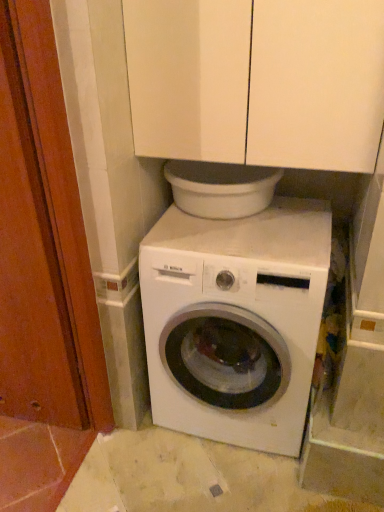
What do you see at coordinates (316, 84) in the screenshot?
I see `white matte cabinet at upper center` at bounding box center [316, 84].

In order to face concrete tile floor at center, should I rotate leftwards or rightwards?

To align with it, rotate right about 4.350°.

Measure the distance between wooden screen door at left and camera.

wooden screen door at left and camera are 3.35 feet apart from each other.

You are a GUI agent. You are given a task and a screenshot of the screen. Output one action in this format:
    pyautogui.click(x=<x>, y=<y>)
    Task: Click on the white matte cabinet at upper center
    The image size is (384, 512).
    Given the screenshot: What is the action you would take?
    pyautogui.click(x=316, y=84)

Which object is wider, wooden screen door at left or white glossy washing machine at center?

Wider between the two is white glossy washing machine at center.

Can you tell me how much wooden screen door at left and white glossy washing machine at center differ in facing direction?

The facing directions of wooden screen door at left and white glossy washing machine at center are 4.7 degrees apart.

In the image, is wooden screen door at left on the left side or the right side of white glossy washing machine at center?

From the image, it's evident that wooden screen door at left is to the left of white glossy washing machine at center.

From a real-world perspective, relative to white glossy washing machine at center, is wooden screen door at left vertically above or below?

wooden screen door at left is situated higher than white glossy washing machine at center in the real world.

Based on the photo, based on their positions, is concrete tile floor at center located to the left or right of white glossy washing machine at center?

concrete tile floor at center is to the left of white glossy washing machine at center.

Is concrete tile floor at center shorter than white glossy washing machine at center?

Indeed, concrete tile floor at center has a lesser height compared to white glossy washing machine at center.

Can you see concrete tile floor at center touching white glossy washing machine at center?

There is a gap between concrete tile floor at center and white glossy washing machine at center.

Measure the distance between concrete tile floor at center and white glossy washing machine at center.

concrete tile floor at center is 42.17 centimeters away from white glossy washing machine at center.

Where is `screen door lying on the left of white glossy washing machine at center`? The height and width of the screenshot is (512, 384). screen door lying on the left of white glossy washing machine at center is located at coordinates (30, 270).

Is point (277, 258) closer or farther from the camera than point (35, 251)?

Point (277, 258) is positioned closer to the camera compared to point (35, 251).

Based on the photo, is white glossy washing machine at center bigger or smaller than wooden screen door at left?

white glossy washing machine at center is bigger than wooden screen door at left.

Is white glossy washing machine at center not within wooden screen door at left?

Indeed, white glossy washing machine at center is completely outside wooden screen door at left.

From the image's perspective, between white glossy washing machine at center and concrete tile floor at center, which one is located above?

white glossy washing machine at center.

Would you say white glossy washing machine at center is inside or outside concrete tile floor at center?

white glossy washing machine at center is located beyond the bounds of concrete tile floor at center.

Is white glossy washing machine at center to the left of concrete tile floor at center from the viewer's perspective?

No.

Is point (253, 393) farther from viewer compared to point (129, 469)?

No.

Is concrete tile floor at center bigger or smaller than white matte cabinet at upper center?

concrete tile floor at center is smaller than white matte cabinet at upper center.

I want to click on concrete to the left of white matte cabinet at upper center, so 183,477.

Which point is more forward, (92, 444) or (331, 101)?

The point (331, 101) is closer to the camera.

In the image, is concrete tile floor at center on the left side or the right side of white matte cabinet at upper center?

Clearly, concrete tile floor at center is on the left of white matte cabinet at upper center in the image.

Between wooden screen door at left and concrete tile floor at center, which one is positioned behind?

concrete tile floor at center is further away from the camera.

Locate an element on the screen. concrete on the right of wooden screen door at left is located at coordinates (183, 477).

Is wooden screen door at left not within concrete tile floor at center?

wooden screen door at left is positioned outside concrete tile floor at center.

Considering the positions of points (29, 404) and (134, 488), is point (29, 404) farther from camera compared to point (134, 488)?

Yes, point (29, 404) is farther from viewer.

From a real-world perspective, does white glossy washing machine at center stand above white matte cabinet at upper center?

No, from a real-world perspective, white glossy washing machine at center is not over white matte cabinet at upper center

Can you confirm if white glossy washing machine at center is shorter than white matte cabinet at upper center?

Incorrect, the height of white glossy washing machine at center does not fall short of that of white matte cabinet at upper center.

Is white glossy washing machine at center spatially inside white matte cabinet at upper center, or outside of it?

white glossy washing machine at center is outside white matte cabinet at upper center.

Are white glossy washing machine at center and white matte cabinet at upper center far apart?

No, white glossy washing machine at center is not far from white matte cabinet at upper center.

Find the location of `washing machine on the right of wooden screen door at left`. washing machine on the right of wooden screen door at left is located at coordinates (235, 321).

Find the location of a particular element. washing machine above the concrete tile floor at center (from the image's perspective) is located at coordinates (235, 321).

Which object lies further to the anchor point wooden screen door at left, white matte cabinet at upper center or white glossy washing machine at center?

white matte cabinet at upper center is positioned further to the anchor wooden screen door at left.

Estimate the real-world distances between objects in this image. Which object is closer to white matte cabinet at upper center, wooden screen door at left or concrete tile floor at center?

wooden screen door at left is positioned closer to the anchor white matte cabinet at upper center.

Estimate the real-world distances between objects in this image. Which object is further from white matte cabinet at upper center, white glossy washing machine at center or concrete tile floor at center?

concrete tile floor at center lies further to white matte cabinet at upper center than the other object.

Which object lies nearer to the anchor point concrete tile floor at center, white matte cabinet at upper center or white glossy washing machine at center?

The object closer to concrete tile floor at center is white glossy washing machine at center.

Which object lies nearer to the anchor point concrete tile floor at center, wooden screen door at left or white glossy washing machine at center?

Among the two, white glossy washing machine at center is located nearer to concrete tile floor at center.

Estimate the real-world distances between objects in this image. Which object is closer to white glossy washing machine at center, concrete tile floor at center or white matte cabinet at upper center?

concrete tile floor at center is closer to white glossy washing machine at center.

Estimate the real-world distances between objects in this image. Which object is closer to white glossy washing machine at center, concrete tile floor at center or wooden screen door at left?

The object closer to white glossy washing machine at center is concrete tile floor at center.

Estimate the real-world distances between objects in this image. Which object is closer to concrete tile floor at center, white matte cabinet at upper center or wooden screen door at left?

Based on the image, wooden screen door at left appears to be nearer to concrete tile floor at center.

In order to click on washing machine that lies between white matte cabinet at upper center and concrete tile floor at center from top to bottom in this screenshot , I will do `click(235, 321)`.

Locate an element on the screen. Image resolution: width=384 pixels, height=512 pixels. screen door between white matte cabinet at upper center and concrete tile floor at center from top to bottom is located at coordinates (30, 270).

Find the location of `washing machine located between wooden screen door at left and white matte cabinet at upper center in the left-right direction`. washing machine located between wooden screen door at left and white matte cabinet at upper center in the left-right direction is located at coordinates (235, 321).

Find the location of `concrete between wooden screen door at left and white glossy washing machine at center from left to right`. concrete between wooden screen door at left and white glossy washing machine at center from left to right is located at coordinates (183, 477).